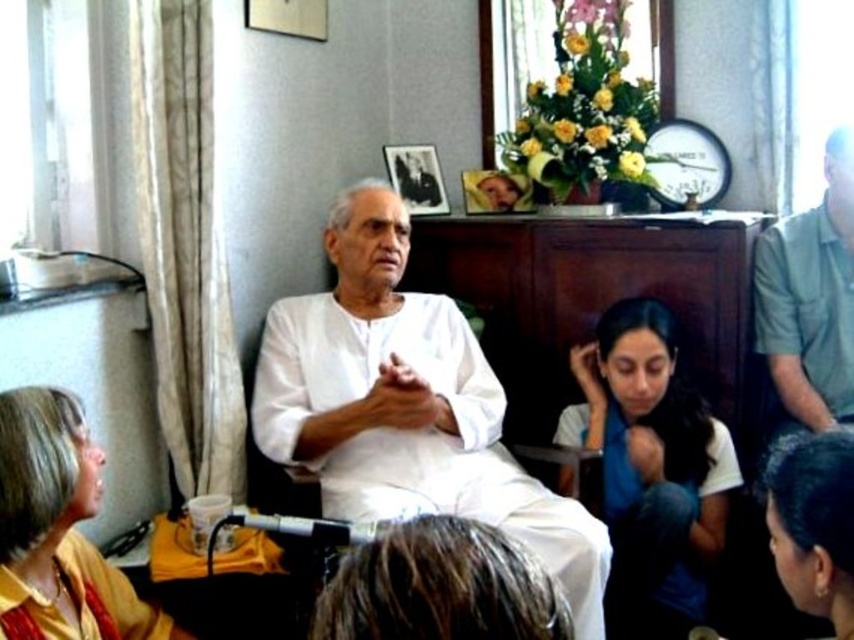
You are a photographer setting up for a group photo in this living room. You need to position a spotlight to the left of the white cotton shirt at lower center and to the right of the yellow fabric at lower left. Is this possible based on their current positions?

The white cotton shirt at lower center is to the right of the yellow fabric at lower left, so placing the spotlight to the left of the white cotton shirt at lower center and to the right of the yellow fabric at lower left is possible as they are positioned in a line from left to right as yellow fabric at lower left then white cotton shirt at lower center.